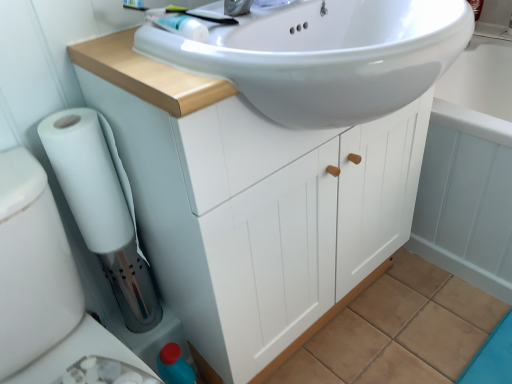
Question: Is white glossy sink at upper center facing towards white matte cabinet at center?

Choices:
 (A) no
 (B) yes

Answer: (B)

Question: Would you say white glossy sink at upper center contains white matte cabinet at center?

Choices:
 (A) yes
 (B) no

Answer: (B)

Question: Can you confirm if white glossy sink at upper center is bigger than white matte cabinet at center?

Choices:
 (A) no
 (B) yes

Answer: (A)

Question: Can you confirm if white glossy sink at upper center is smaller than white matte cabinet at center?

Choices:
 (A) yes
 (B) no

Answer: (A)

Question: Considering the relative sizes of white glossy sink at upper center and white matte cabinet at center in the image provided, is white glossy sink at upper center thinner than white matte cabinet at center?

Choices:
 (A) no
 (B) yes

Answer: (A)

Question: Choose the correct answer: Is white matte cabinet at center inside white plastic bidet at lower left, acting as the 1th bidet starting from the bottom, or outside it?

Choices:
 (A) inside
 (B) outside

Answer: (B)

Question: Is white matte cabinet at center bigger or smaller than white plastic bidet at lower left, acting as the 1th bidet starting from the bottom?

Choices:
 (A) big
 (B) small

Answer: (A)

Question: From the image's perspective, is white matte cabinet at center above or below white plastic bidet at lower left, acting as the 1th bidet starting from the bottom?

Choices:
 (A) above
 (B) below

Answer: (A)

Question: Is white matte cabinet at center to the left or to the right of white plastic bidet at lower left, acting as the 1th bidet starting from the bottom, in the image?

Choices:
 (A) left
 (B) right

Answer: (B)

Question: Is white plastic bidet at lower left, acting as the 1th bidet starting from the bottom, taller or shorter than blue plastic bidet at lower left, which appears as the 2th bidet when ordered from the bottom?

Choices:
 (A) short
 (B) tall

Answer: (B)

Question: In terms of width, does white plastic bidet at lower left, which is counted as the 2th bidet, starting from the top, look wider or thinner when compared to blue plastic bidet at lower left, which appears as the 2th bidet when ordered from the bottom?

Choices:
 (A) thin
 (B) wide

Answer: (B)

Question: Do you think white plastic bidet at lower left, which is counted as the 2th bidet, starting from the top, is within blue plastic bidet at lower left, positioned as the first bidet in top-to-bottom order, or outside of it?

Choices:
 (A) inside
 (B) outside

Answer: (B)

Question: From the image's perspective, is white plastic bidet at lower left, which is counted as the 2th bidet, starting from the top, located above or below blue plastic bidet at lower left, positioned as the first bidet in top-to-bottom order?

Choices:
 (A) above
 (B) below

Answer: (B)

Question: From the image's perspective, relative to white glossy sink at upper center, is blue plastic bidet at lower left, positioned as the first bidet in top-to-bottom order, above or below?

Choices:
 (A) below
 (B) above

Answer: (A)

Question: Considering the positions of blue plastic bidet at lower left, positioned as the first bidet in top-to-bottom order, and white glossy sink at upper center in the image, is blue plastic bidet at lower left, positioned as the first bidet in top-to-bottom order, taller or shorter than white glossy sink at upper center?

Choices:
 (A) short
 (B) tall

Answer: (A)